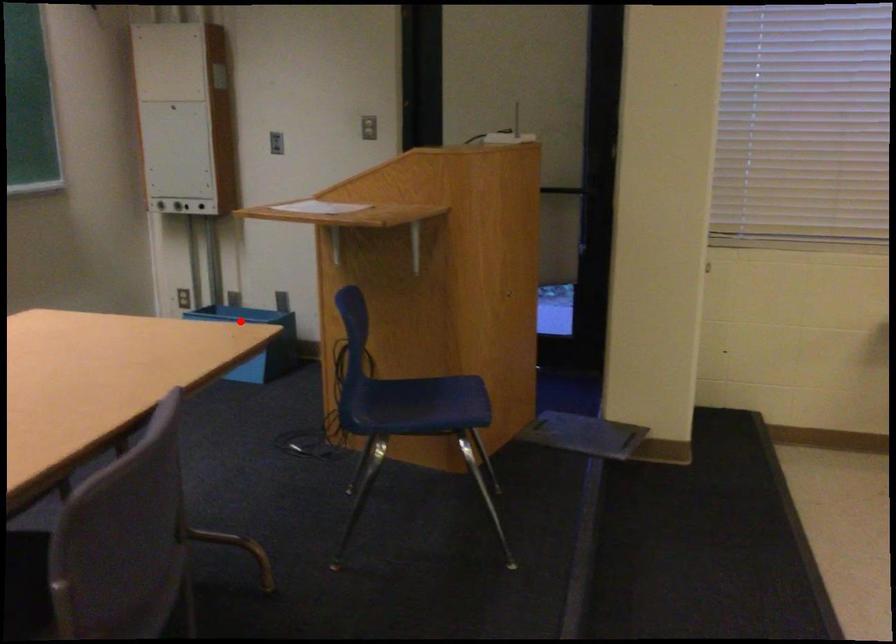
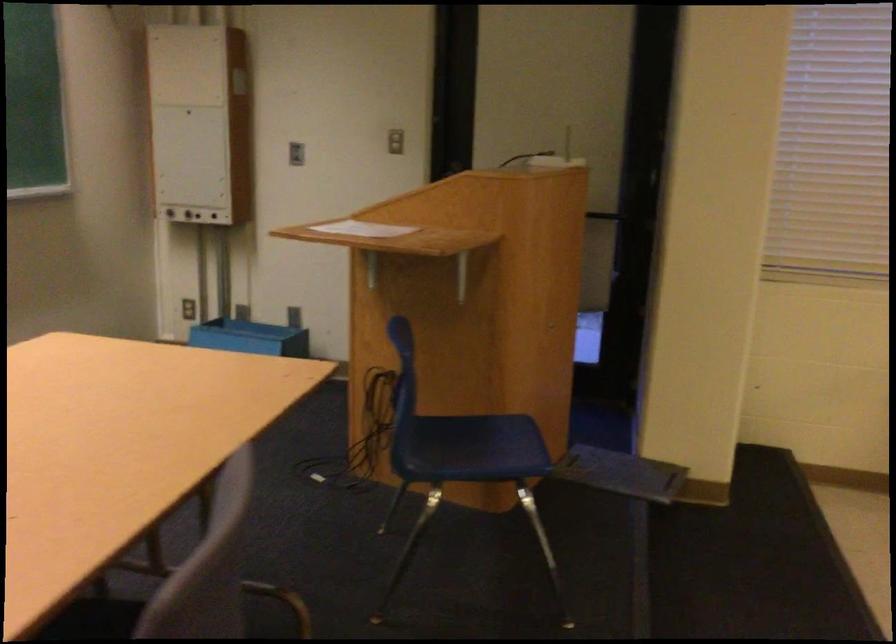
Where in the second image is the point corresponding to the highlighted location from the first image?

(250, 337)